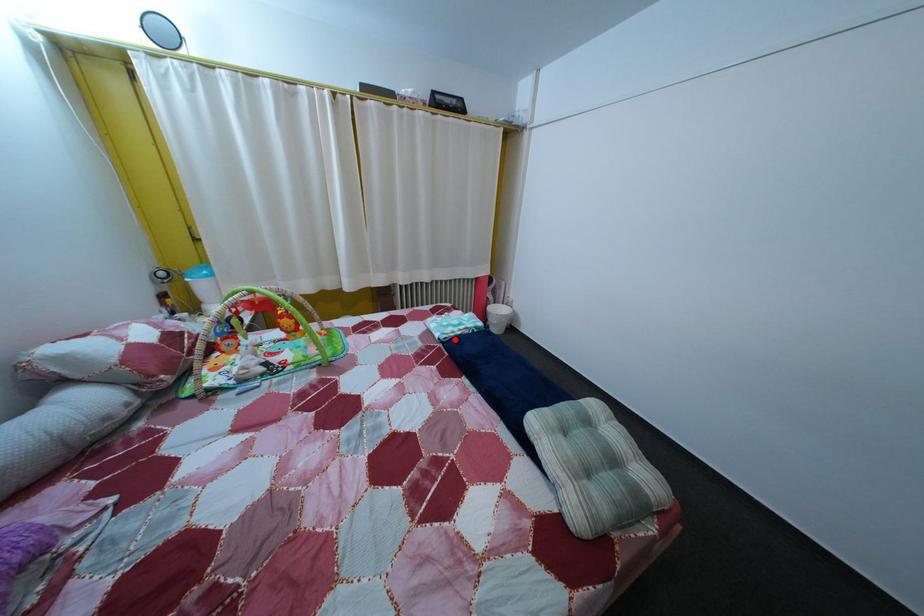
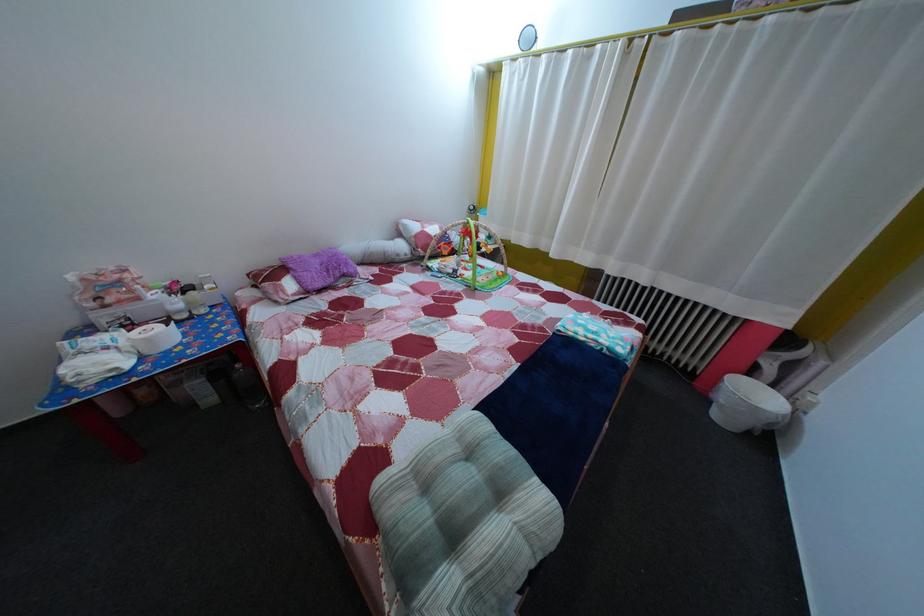
Question: I am providing you with two images of the same scene from different viewpoints. Image1 has a red point marked. In image2, the corresponding 3D location appears at what relative position? Reply with the corresponding letter.

Choices:
 (A) Closer
 (B) Farther

Answer: (A)